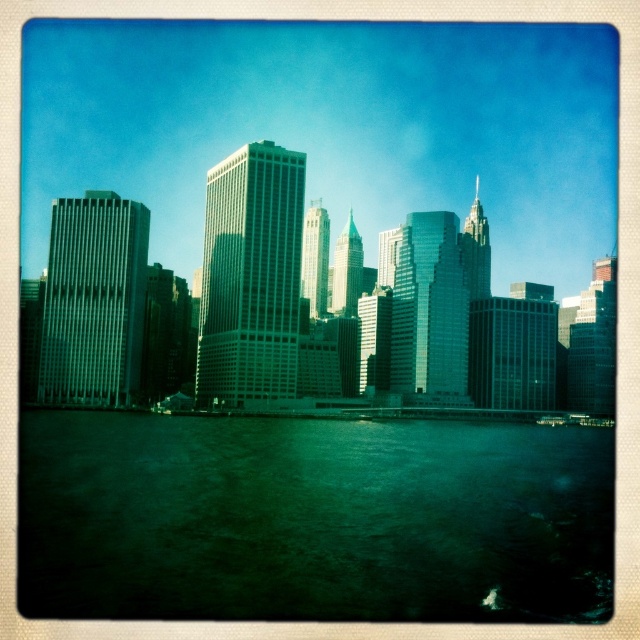
Question: Which point is farther from the camera taking this photo?

Choices:
 (A) (291, 548)
 (B) (412, 314)

Answer: (B)

Question: Can you confirm if green liquid water at lower center is bigger than glassy skyscrapers at center?

Choices:
 (A) no
 (B) yes

Answer: (A)

Question: Does green liquid water at lower center lie behind glassy skyscrapers at center?

Choices:
 (A) no
 (B) yes

Answer: (A)

Question: Is the position of green liquid water at lower center more distant than that of glassy skyscrapers at center?

Choices:
 (A) no
 (B) yes

Answer: (A)